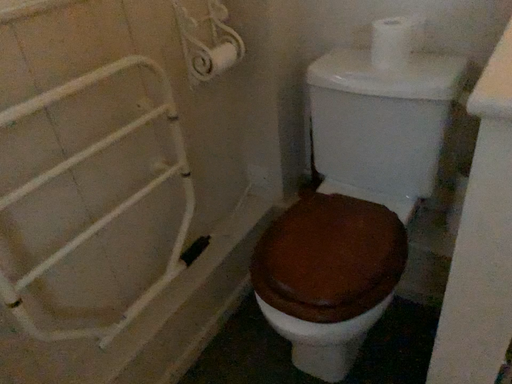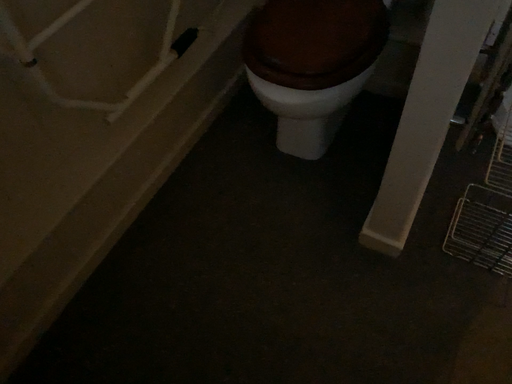
Question: Which way did the camera rotate in the video?

Choices:
 (A) rotated downward
 (B) rotated upward

Answer: (A)